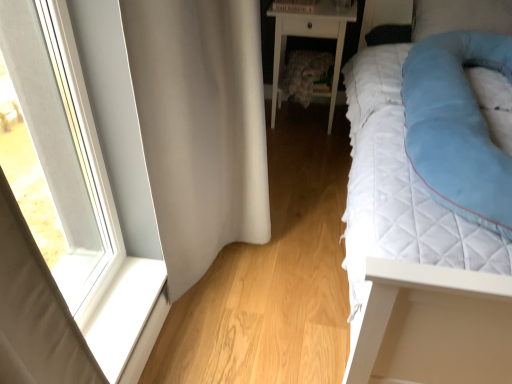
Where is `free location in front of white fabric curtain at left`? The image size is (512, 384). free location in front of white fabric curtain at left is located at coordinates [x=269, y=319].